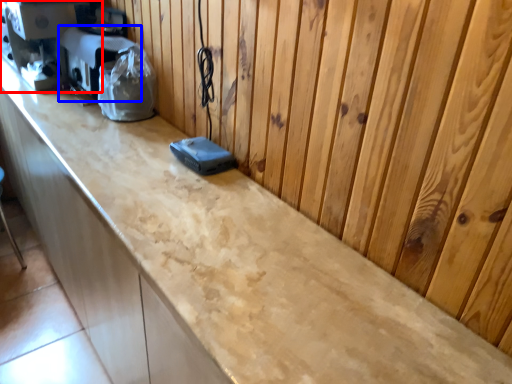
Question: Which object is further to the camera taking this photo, coffee machine (highlighted by a red box) or appliance (highlighted by a blue box)?

Choices:
 (A) coffee machine
 (B) appliance

Answer: (A)